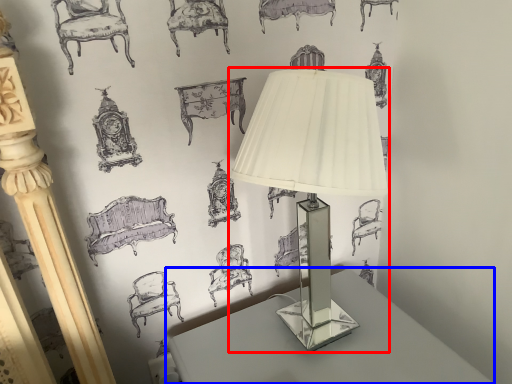
Question: Which object is closer to the camera taking this photo, lamp (highlighted by a red box) or table (highlighted by a blue box)?

Choices:
 (A) lamp
 (B) table

Answer: (A)